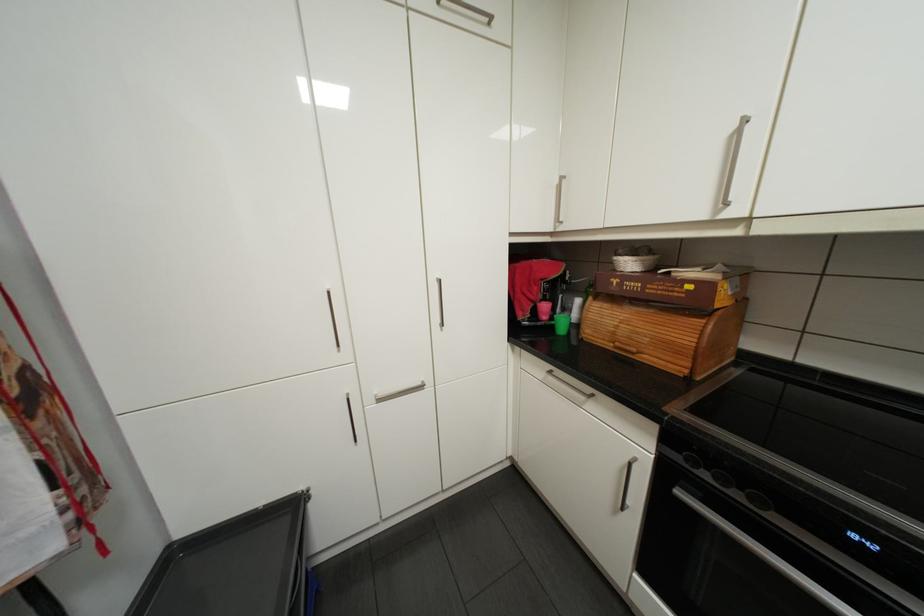
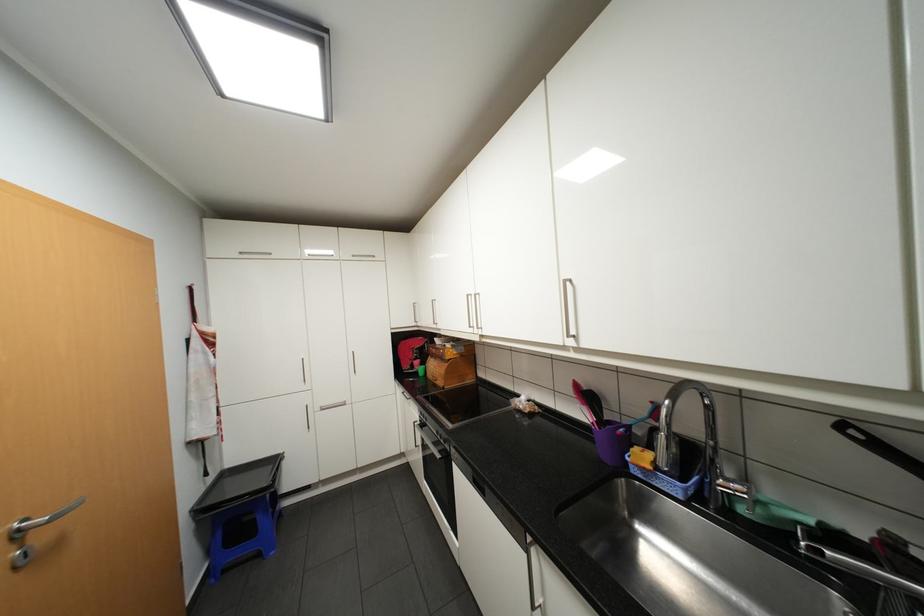
Where in the second image is the point corresponding to pixel 602 297 from the first image?

(440, 355)